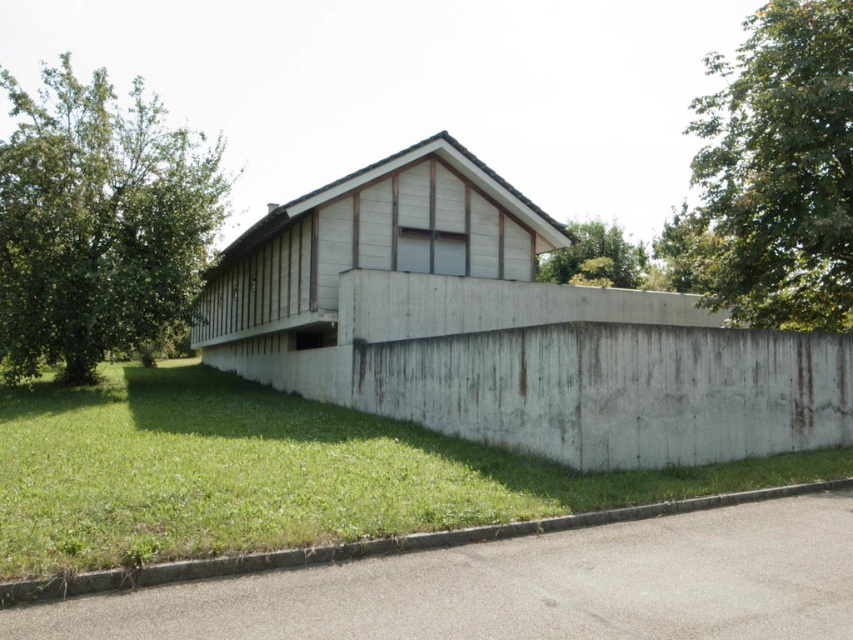
You are standing in the middle of the building and looking towards the front. Which object, the green grass at lower left or the green leafy tree at upper right, appears closer to you?

The green grass at lower left appears closer to you because it is smaller than the green leafy tree at upper right, which is larger and therefore farther away.

From the picture: You are standing at the entrance of the modern building and want to locate two specific points marked on the map. The first point is at coordinate point (624,499) and the second is at coordinate point (825,61). From your current position, which point is closer to you?

Point (624,499) is in front of point (825,61), so the first point is closer to you.

You are standing in front of the modern building and want to walk towards the gray concrete curb at lower right and the green leafy tree at upper right. Which object will you reach first?

You will reach the gray concrete curb at lower right first because it is closer to the viewer than the green leafy tree at upper right.